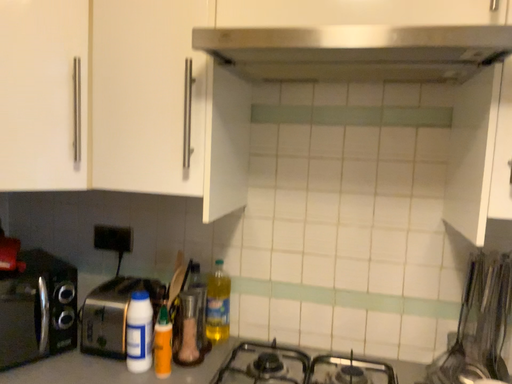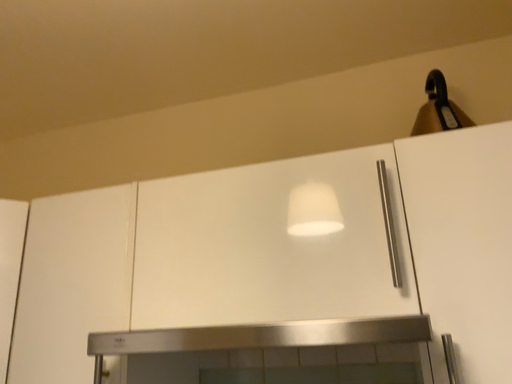
Question: How did the camera likely rotate when shooting the video?

Choices:
 (A) rotated downward
 (B) rotated upward

Answer: (B)